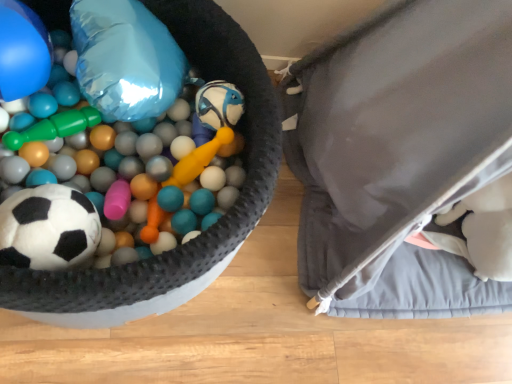
Question: Can you confirm if blue glossy balloon at upper left, which is the first balloon in left-to-right order, is thinner than shiny metallic balloon at upper left, the first balloon viewed from the right?

Choices:
 (A) yes
 (B) no

Answer: (A)

Question: Could you tell me if blue glossy balloon at upper left, which is the first balloon in left-to-right order, is turned towards shiny metallic balloon at upper left, which is the second balloon in left-to-right order?

Choices:
 (A) no
 (B) yes

Answer: (A)

Question: Can you confirm if blue glossy balloon at upper left, which is the first balloon in left-to-right order, is taller than shiny metallic balloon at upper left, the first balloon viewed from the right?

Choices:
 (A) yes
 (B) no

Answer: (A)

Question: From the image's perspective, is blue glossy balloon at upper left, which is the first balloon in left-to-right order, on shiny metallic balloon at upper left, the first balloon viewed from the right?

Choices:
 (A) no
 (B) yes

Answer: (A)

Question: Does blue glossy balloon at upper left, the second balloon in the right-to-left sequence, contain shiny metallic balloon at upper left, which is the second balloon in left-to-right order?

Choices:
 (A) no
 (B) yes

Answer: (A)

Question: In the image, is white matte soccer ball at left on the left side or the right side of gray fabric bean bag chair at right?

Choices:
 (A) left
 (B) right

Answer: (A)

Question: Is white matte soccer ball at left inside the boundaries of gray fabric bean bag chair at right, or outside?

Choices:
 (A) outside
 (B) inside

Answer: (A)

Question: Is white matte soccer ball at left in front of or behind gray fabric bean bag chair at right in the image?

Choices:
 (A) front
 (B) behind

Answer: (B)

Question: From a real-world perspective, is white matte soccer ball at left positioned above or below gray fabric bean bag chair at right?

Choices:
 (A) above
 (B) below

Answer: (B)

Question: From the image's perspective, is gray fabric bean bag chair at right above or below soft plush soccer ball at left?

Choices:
 (A) above
 (B) below

Answer: (A)

Question: Is gray fabric bean bag chair at right taller or shorter than soft plush soccer ball at left?

Choices:
 (A) tall
 (B) short

Answer: (A)

Question: In the image, is gray fabric bean bag chair at right positioned in front of or behind soft plush soccer ball at left?

Choices:
 (A) behind
 (B) front

Answer: (B)

Question: Is gray fabric bean bag chair at right wider or thinner than soft plush soccer ball at left?

Choices:
 (A) thin
 (B) wide

Answer: (B)

Question: Is shiny metallic balloon at upper left, which is the second balloon in left-to-right order, to the left or to the right of blue glossy balloon at upper left, the second balloon in the right-to-left sequence, in the image?

Choices:
 (A) left
 (B) right

Answer: (B)

Question: From the image's perspective, is shiny metallic balloon at upper left, the first balloon viewed from the right, positioned above or below blue glossy balloon at upper left, which is the first balloon in left-to-right order?

Choices:
 (A) below
 (B) above

Answer: (B)